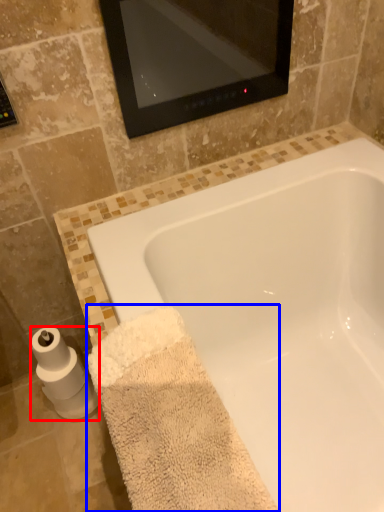
Question: Which object appears closest to the camera in this image, toilet paper (highlighted by a red box) or bath towel (highlighted by a blue box)?

Choices:
 (A) toilet paper
 (B) bath towel

Answer: (B)